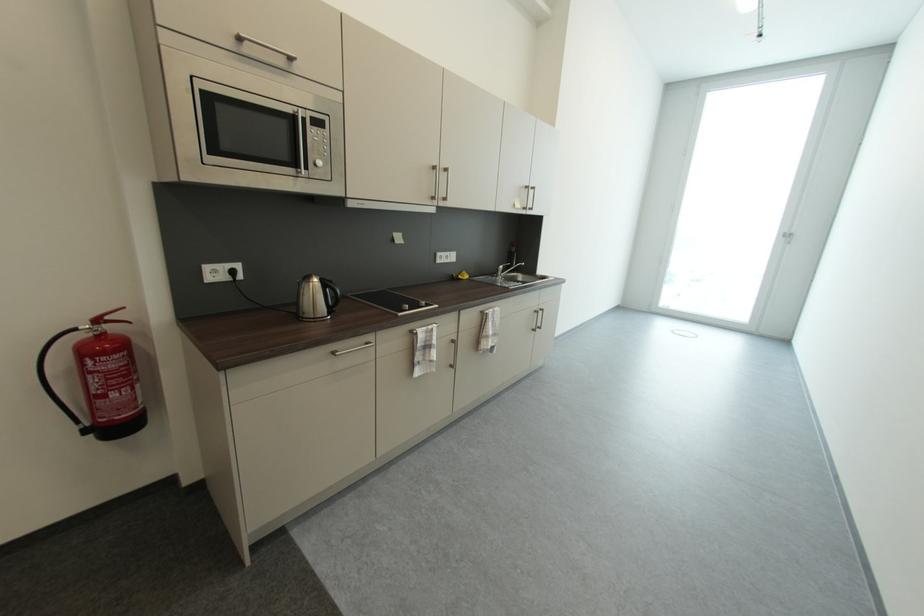
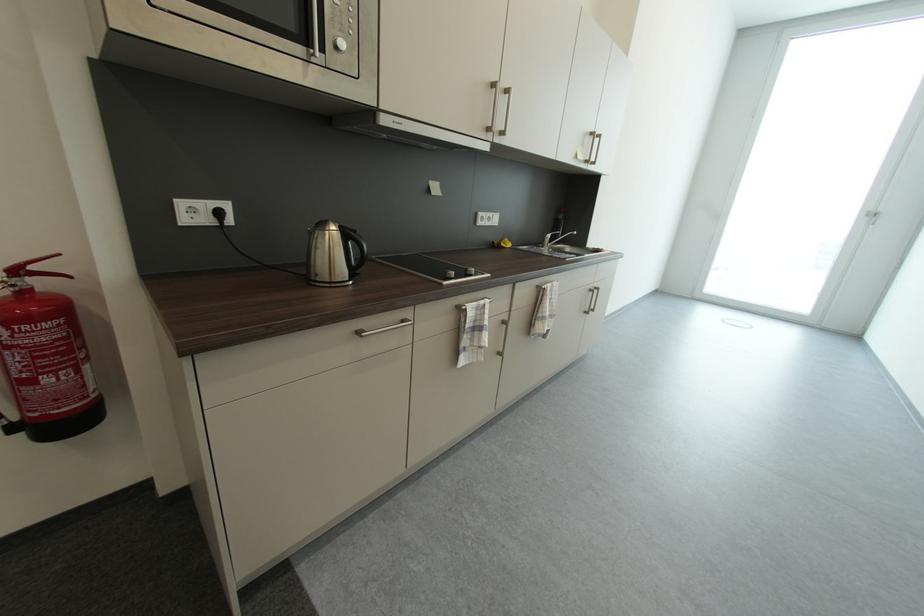
Question: The first image is from the beginning of the video and the second image is from the end. How did the camera likely rotate when shooting the video?

Choices:
 (A) Left
 (B) Right
 (C) Up
 (D) Down

Answer: (D)